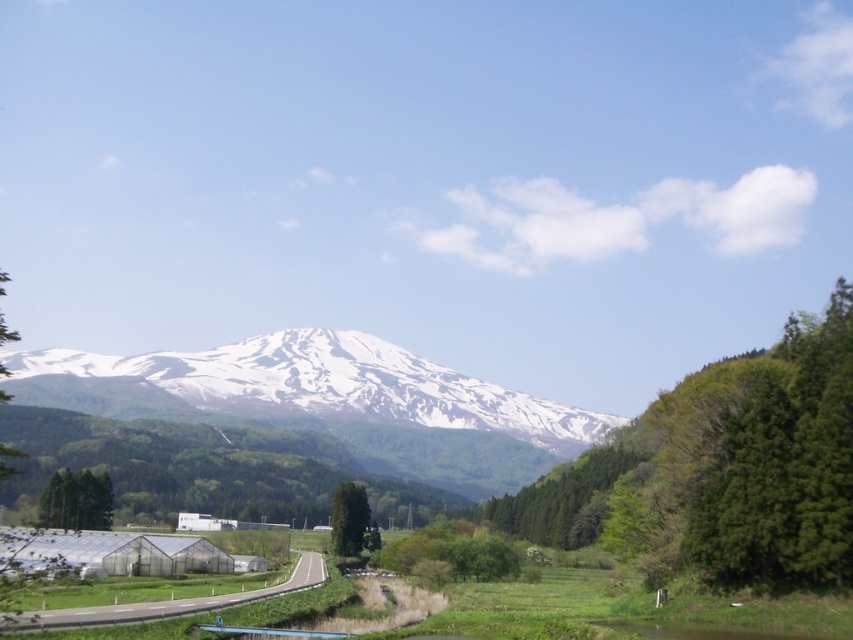
You are a hiker standing at the starting point of the road. You see the green matte tree at lower left and the green matte tree at center. Which tree is wider?

The green matte tree at lower left is wider than the green matte tree at center.